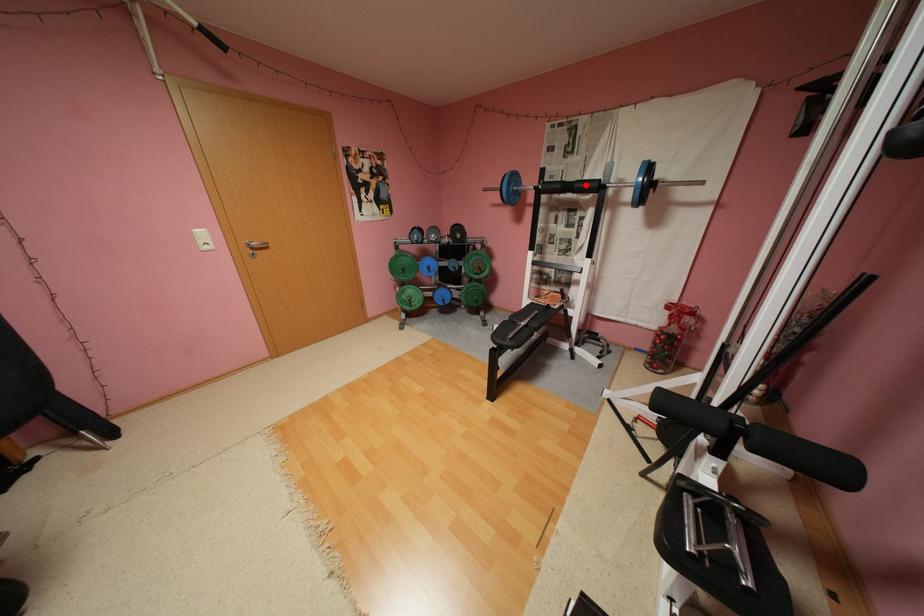
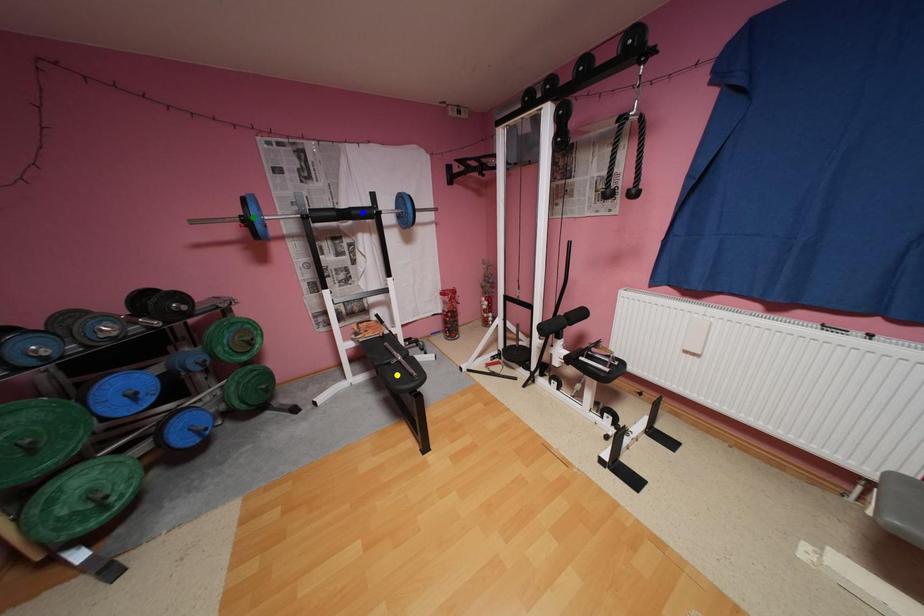
Question: I am providing you with two images of the same scene from different viewpoints. A red point is marked on the first image. You are given multiple points on the second image. In image 2, which mark is for the same physical point as the one in image 1?

Choices:
 (A) yellow point
 (B) blue point
 (C) green point

Answer: (B)